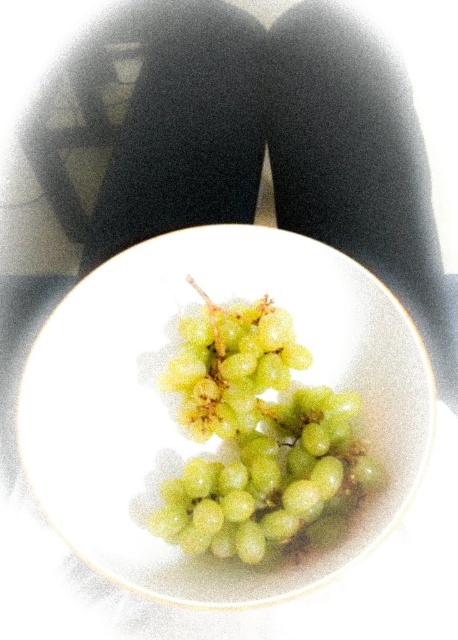
You are arranging a fruit platter and need to place the white glossy platter at center and the green matte grapes at center in a specific order. According to the image, which object is positioned to the right?

The green matte grapes at center are positioned to the right of the white glossy platter at center.

Looking at this image, you are a chef holding a knife that is 9 inches long. You want to cut the grapes on the white glossy platter at center. If you extend your arm fully, which is 28 inches long, can you reach the platter?

The white glossy platter at center is 28.16 inches away from the viewer. Since your arm is 28 inches long, you cannot quite reach the platter as the distance is slightly longer than your arm length.